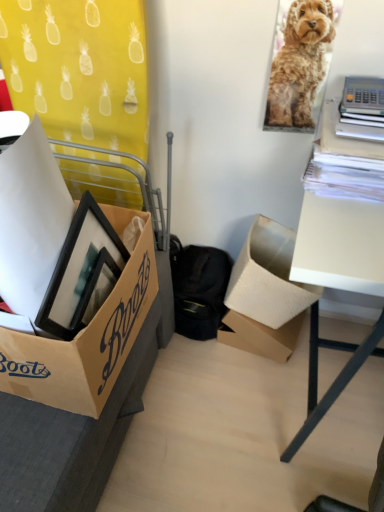
The height and width of the screenshot is (512, 384). What do you see at coordinates (340, 245) in the screenshot? I see `white matte table at right` at bounding box center [340, 245].

This screenshot has height=512, width=384. Describe the element at coordinates (267, 277) in the screenshot. I see `cardboard box at lower right, the third box viewed from the left` at that location.

You are a GUI agent. You are given a task and a screenshot of the screen. Output one action in this format:
    pyautogui.click(x=<x>, y=<y>)
    Task: Click on the white matte table at right
    This screenshot has height=512, width=384.
    Given the screenshot: What is the action you would take?
    pyautogui.click(x=340, y=245)

From the image's perspective, which one is positioned lower, cardboard box at lower right, the third box viewed from the left, or white matte table at right?

white matte table at right is shown below in the image.

Can you confirm if cardboard box at lower right, which is the 1th box in right-to-left order, is taller than white matte table at right?

In fact, cardboard box at lower right, which is the 1th box in right-to-left order, may be shorter than white matte table at right.

Measure the distance between cardboard box at lower right, which is the 1th box in right-to-left order, and white matte table at right.

cardboard box at lower right, which is the 1th box in right-to-left order, and white matte table at right are 26.66 centimeters apart from each other.

Is brown cardboard box at lower left, marked as the first box in a left-to-right arrangement, bigger or smaller than cardboard box at lower right, which is the 1th box in right-to-left order?

Considering their sizes, brown cardboard box at lower left, marked as the first box in a left-to-right arrangement, takes up more space than cardboard box at lower right, which is the 1th box in right-to-left order.

Which is behind, brown cardboard box at lower left, positioned as the 3th box in right-to-left order, or cardboard box at lower right, the third box viewed from the left?

cardboard box at lower right, the third box viewed from the left, is further away from the camera.

How different are the orientations of brown cardboard box at lower left, marked as the first box in a left-to-right arrangement, and cardboard box at lower right, the third box viewed from the left, in degrees?

The angle between the facing direction of brown cardboard box at lower left, marked as the first box in a left-to-right arrangement, and the facing direction of cardboard box at lower right, the third box viewed from the left, is 88.1 degrees.

Who is shorter, white matte table at right or brown cardboard box at center, arranged as the 2th box when viewed from the right?

Standing shorter between the two is brown cardboard box at center, arranged as the 2th box when viewed from the right.

From the image's perspective, is white matte table at right above or below brown cardboard box at center, arranged as the 2th box when viewed from the right?

From the image's perspective, white matte table at right appears above brown cardboard box at center, arranged as the 2th box when viewed from the right.

Does white matte table at right have a larger size compared to brown cardboard box at center, arranged as the 2th box when viewed from the right?

Yes, white matte table at right is bigger than brown cardboard box at center, arranged as the 2th box when viewed from the right.

From a real-world perspective, which object rests below the other?

In real-world perspective, brown cardboard box at center, arranged as the 2th box when viewed from the right, is lower.

Does cardboard box at lower right, which is the 1th box in right-to-left order, have a greater height compared to brown cardboard box at center, the second box positioned from the left?

Correct, cardboard box at lower right, which is the 1th box in right-to-left order, is much taller as brown cardboard box at center, the second box positioned from the left.

Which of these two, cardboard box at lower right, the third box viewed from the left, or brown cardboard box at center, the second box positioned from the left, is bigger?

Bigger between the two is cardboard box at lower right, the third box viewed from the left.

Considering the relative sizes of cardboard box at lower right, which is the 1th box in right-to-left order, and brown cardboard box at center, the second box positioned from the left, in the image provided, is cardboard box at lower right, which is the 1th box in right-to-left order, thinner than brown cardboard box at center, the second box positioned from the left,?

No, cardboard box at lower right, which is the 1th box in right-to-left order, is not thinner than brown cardboard box at center, the second box positioned from the left.

Can you confirm if cardboard box at lower right, the third box viewed from the left, is positioned to the right of brown cardboard box at center, the second box positioned from the left?

Indeed, cardboard box at lower right, the third box viewed from the left, is positioned on the right side of brown cardboard box at center, the second box positioned from the left.

In terms of size, does golden fur dog at upper right appear bigger or smaller than white matte table at right?

Considering their sizes, golden fur dog at upper right takes up less space than white matte table at right.

From the image's perspective, is golden fur dog at upper right above or below white matte table at right?

Clearly, from the image's perspective, golden fur dog at upper right is above white matte table at right.

Does point (279, 89) appear closer or farther from the camera than point (331, 217)?

Point (279, 89).

The height and width of the screenshot is (512, 384). In order to click on table lying on the right of golden fur dog at upper right in this screenshot , I will do `click(340, 245)`.

Consider the image. Which is more to the left, white matte table at right or golden fur dog at upper right?

From the viewer's perspective, golden fur dog at upper right appears more on the left side.

Considering the relative sizes of white matte table at right and golden fur dog at upper right in the image provided, is white matte table at right shorter than golden fur dog at upper right?

In fact, white matte table at right may be taller than golden fur dog at upper right.

At what (x,y) coordinates should I click in order to perform the action: click on dog on the left of white matte table at right. Please return your answer as a coordinate pair (x, y). Looking at the image, I should click on (299, 64).

Which object is closer to the camera, white matte table at right or golden fur dog at upper right?

Positioned in front is white matte table at right.

What's the angular difference between golden fur dog at upper right and brown cardboard box at center, the second box positioned from the left,'s facing directions?

The angle between the facing direction of golden fur dog at upper right and the facing direction of brown cardboard box at center, the second box positioned from the left, is 5.22 degrees.

Is golden fur dog at upper right beside brown cardboard box at center, the second box positioned from the left?

There is a gap between golden fur dog at upper right and brown cardboard box at center, the second box positioned from the left.

Is golden fur dog at upper right to the right of brown cardboard box at center, arranged as the 2th box when viewed from the right, from the viewer's perspective?

Yes, golden fur dog at upper right is to the right of brown cardboard box at center, arranged as the 2th box when viewed from the right.

In terms of width, does golden fur dog at upper right look wider or thinner when compared to brown cardboard box at center, arranged as the 2th box when viewed from the right?

In the image, golden fur dog at upper right appears to be more narrow than brown cardboard box at center, arranged as the 2th box when viewed from the right.

Image resolution: width=384 pixels, height=512 pixels. Find the location of `table lying in front of the cardboard box at lower right, which is the 1th box in right-to-left order`. table lying in front of the cardboard box at lower right, which is the 1th box in right-to-left order is located at coordinates (340, 245).

Identify the location of box that appears above the brown cardboard box at lower left, positioned as the 3th box in right-to-left order (from the image's perspective). This screenshot has height=512, width=384. pos(267,277).

Estimate the real-world distances between objects in this image. Which object is closer to brown cardboard box at center, the second box positioned from the left, white matte table at right or brown cardboard box at lower left, positioned as the 3th box in right-to-left order?

white matte table at right.

Which object lies further to the anchor point brown cardboard box at center, the second box positioned from the left, golden fur dog at upper right or white matte table at right?

golden fur dog at upper right is positioned further to the anchor brown cardboard box at center, the second box positioned from the left.

Considering their positions, is white matte table at right positioned closer to golden fur dog at upper right than brown cardboard box at lower left, marked as the first box in a left-to-right arrangement?

white matte table at right lies closer to golden fur dog at upper right than the other object.

When comparing their distances from cardboard box at lower right, the third box viewed from the left, does brown cardboard box at center, the second box positioned from the left, or brown cardboard box at lower left, marked as the first box in a left-to-right arrangement, seem closer?

Based on the image, brown cardboard box at center, the second box positioned from the left, appears to be nearer to cardboard box at lower right, the third box viewed from the left.

When comparing their distances from brown cardboard box at center, arranged as the 2th box when viewed from the right, does golden fur dog at upper right or brown cardboard box at lower left, positioned as the 3th box in right-to-left order, seem closer?

The object closer to brown cardboard box at center, arranged as the 2th box when viewed from the right, is brown cardboard box at lower left, positioned as the 3th box in right-to-left order.

Which object lies nearer to the anchor point brown cardboard box at lower left, positioned as the 3th box in right-to-left order, cardboard box at lower right, the third box viewed from the left, or white matte table at right?

white matte table at right lies closer to brown cardboard box at lower left, positioned as the 3th box in right-to-left order, than the other object.

From the picture: When comparing their distances from brown cardboard box at center, the second box positioned from the left, does cardboard box at lower right, which is the 1th box in right-to-left order, or golden fur dog at upper right seem further?

Based on the image, golden fur dog at upper right appears to be further to brown cardboard box at center, the second box positioned from the left.

Based on their spatial positions, is brown cardboard box at lower left, positioned as the 3th box in right-to-left order, or brown cardboard box at center, the second box positioned from the left, closer to golden fur dog at upper right?

brown cardboard box at lower left, positioned as the 3th box in right-to-left order, is positioned closer to the anchor golden fur dog at upper right.

This screenshot has height=512, width=384. Find the location of `box between golden fur dog at upper right and brown cardboard box at lower left, positioned as the 3th box in right-to-left order, vertically`. box between golden fur dog at upper right and brown cardboard box at lower left, positioned as the 3th box in right-to-left order, vertically is located at coordinates point(267,277).

You are a GUI agent. You are given a task and a screenshot of the screen. Output one action in this format:
    pyautogui.click(x=<x>, y=<y>)
    Task: Click on the box positioned between brown cardboard box at lower left, positioned as the 3th box in right-to-left order, and brown cardboard box at center, arranged as the 2th box when viewed from the right, from near to far
    This screenshot has height=512, width=384.
    Given the screenshot: What is the action you would take?
    pyautogui.click(x=267, y=277)

I want to click on dog located between brown cardboard box at lower left, marked as the first box in a left-to-right arrangement, and white matte table at right in the left-right direction, so click(x=299, y=64).

Identify the location of table that lies between golden fur dog at upper right and brown cardboard box at center, the second box positioned from the left, from top to bottom. This screenshot has width=384, height=512. (340, 245).